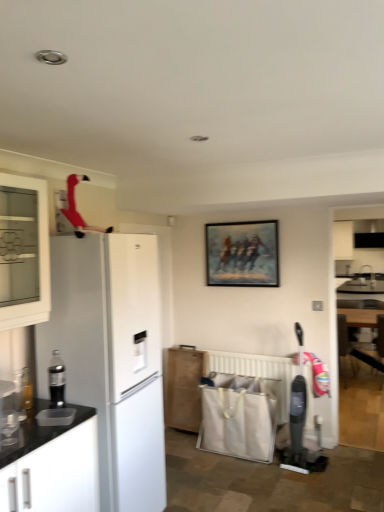
Question: Considering the positions of point (183, 375) and point (56, 353), is point (183, 375) closer or farther from the camera than point (56, 353)?

Choices:
 (A) farther
 (B) closer

Answer: (A)

Question: Considering the positions of wooden cabinet at lower center, marked as the 2th cabinetry in a left-to-right arrangement, and black plastic soda dispenser at left in the image, is wooden cabinet at lower center, marked as the 2th cabinetry in a left-to-right arrangement, taller or shorter than black plastic soda dispenser at left?

Choices:
 (A) tall
 (B) short

Answer: (A)

Question: Based on their relative distances, which object is farther from the white plastic radiator at lower center?

Choices:
 (A) black plastic soda dispenser at left
 (B) white matte refrigerator at left
 (C) white glass cabinet at left, which is counted as the second cabinetry, starting from the right
 (D) wooden armchair at lower right
 (E) wooden cabinet at lower center, positioned as the second cabinetry in top-to-bottom order

Answer: (D)

Question: Which object is the farthest from the black plastic soda dispenser at left?

Choices:
 (A) white plastic radiator at lower center
 (B) wooden cabinet at lower center, which is counted as the second cabinetry, starting from the front
 (C) wooden armchair at lower right
 (D) oil painting at center
 (E) white glass cabinet at left, which appears as the 2th cabinetry when ordered from the bottom

Answer: (C)